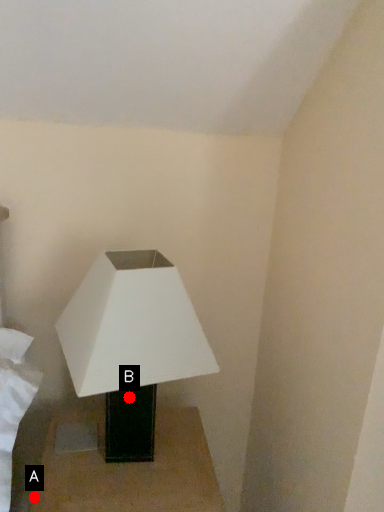
Question: Two points are circled on the image, labeled by A and B beside each circle. Which point appears farthest from the camera in this image?

Choices:
 (A) A is further
 (B) B is further

Answer: (B)